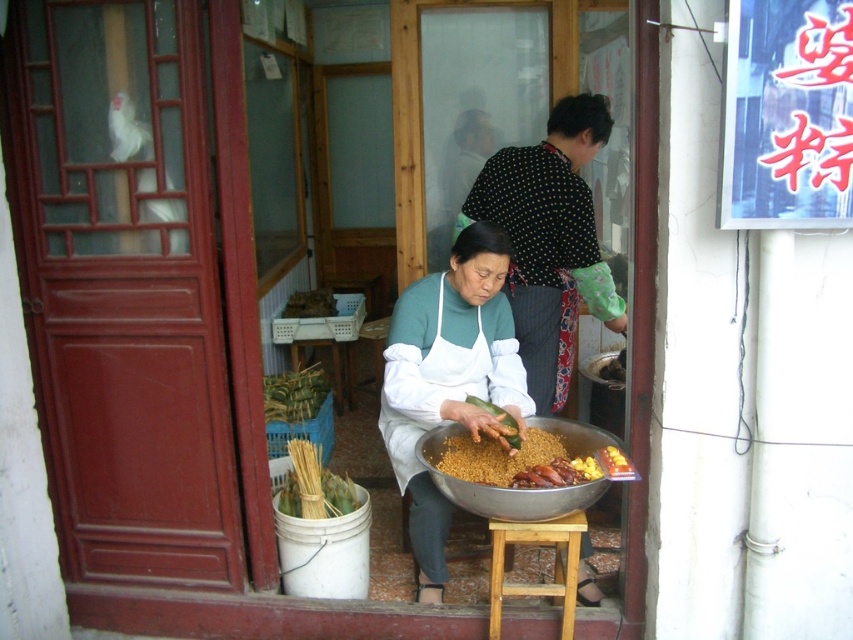
You are a customer in the shop and want to point out both the brown matte roasted duck at center and the green leafy vegetable at center to the shopkeeper. Which one is located to the right of the other?

The brown matte roasted duck at center is to the right of the green leafy vegetable at center.